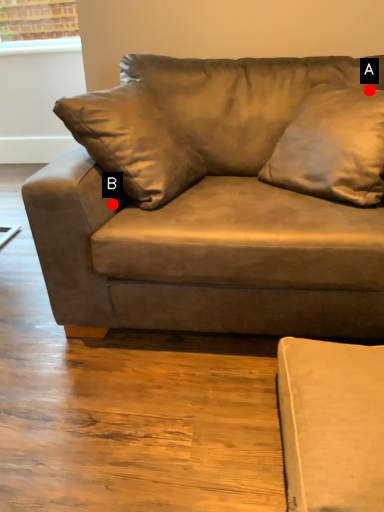
Question: Two points are circled on the image, labeled by A and B beside each circle. Among these points, which one is nearest to the camera?

Choices:
 (A) A is closer
 (B) B is closer

Answer: (B)